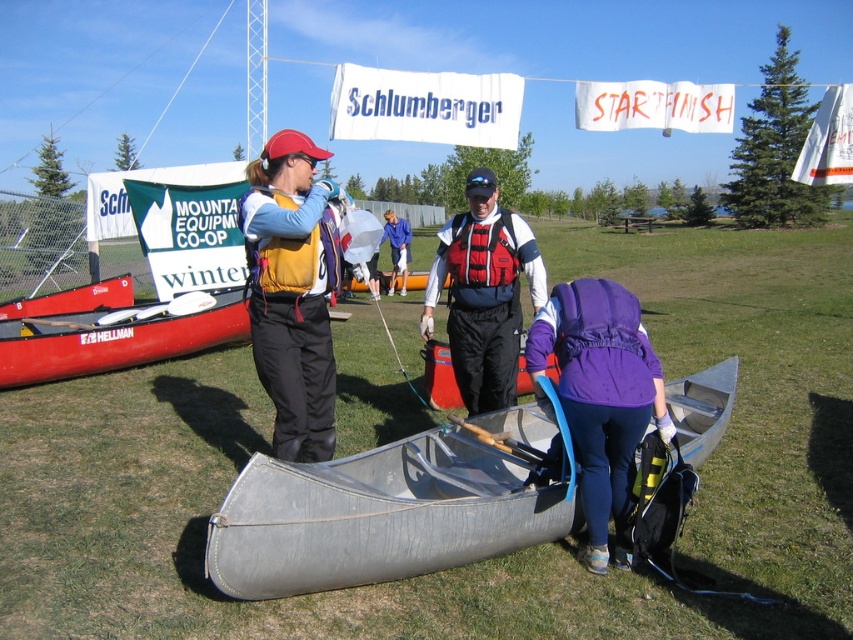
Question: Which of the following is the closest to the observer?

Choices:
 (A) (489, 253)
 (B) (426, 384)
 (C) (625, 397)
 (D) (114, 305)

Answer: (C)

Question: Can you confirm if matte yellow life vest at center is positioned below red/white life vest at center?

Choices:
 (A) yes
 (B) no

Answer: (B)

Question: Is purple fabric backpack at lower center bigger than matte yellow life jacket at center?

Choices:
 (A) yes
 (B) no

Answer: (A)

Question: Does matte yellow life vest at center come in front of matte yellow life jacket at center?

Choices:
 (A) no
 (B) yes

Answer: (A)

Question: Which object appears farthest from the camera in this image?

Choices:
 (A) red/white life vest at center
 (B) purple fabric backpack at lower center

Answer: (A)

Question: Estimate the real-world distances between objects in this image. Which object is farther from the blue fabric shirt at center?

Choices:
 (A) red mesh life jacket at center
 (B) metallic gray canoe at center
 (C) matte yellow life jacket at center

Answer: (B)